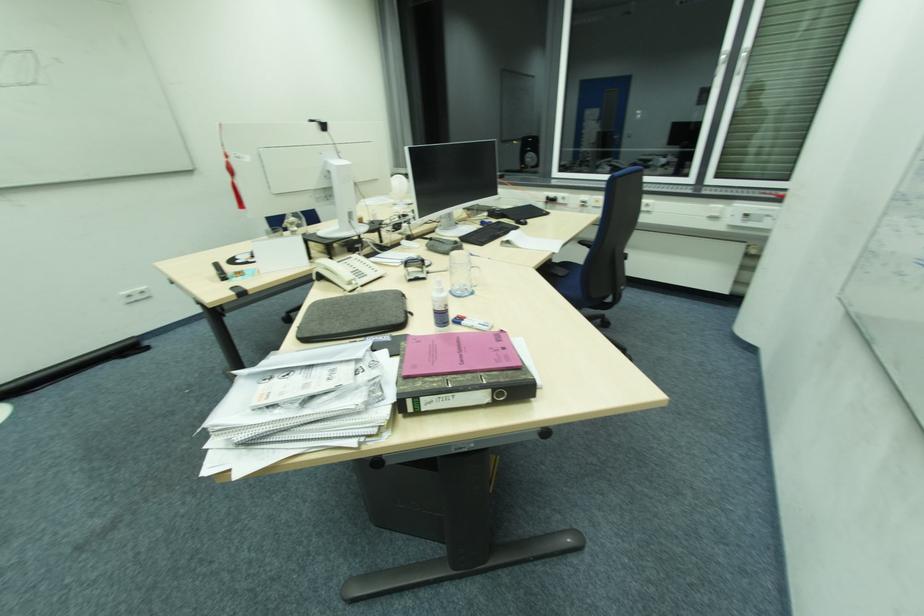
You are a GUI agent. You are given a task and a screenshot of the screen. Output one action in this format:
    pyautogui.click(x=<x>, y=<y>)
    Task: Click on the phone handset
    
    Given the screenshot: What is the action you would take?
    pyautogui.click(x=350, y=272)